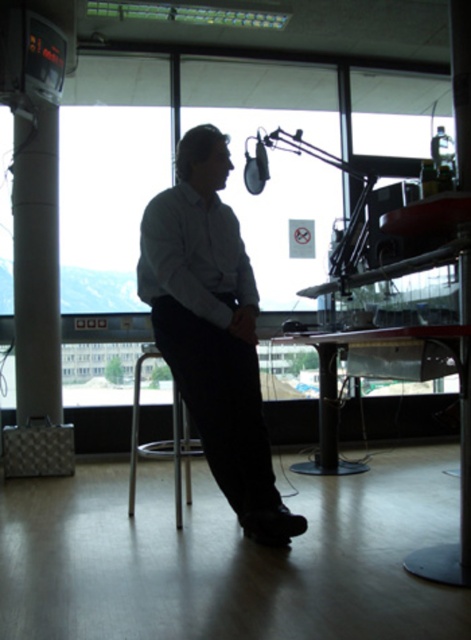
You are a photographer adjusting the lighting in the studio. You need to ensure that both the white glossy pillar at left and the white matte dress shirt at center are properly lit. Since the pillar is reflective, it might cause glare. Given their positions, which object is closer to the left side of the frame and could potentially reflect light back into the camera?

The white glossy pillar at left is to the left of the white matte dress shirt at center, so it is closer to the left side of the frame. This position makes it more likely to reflect light back into the camera, causing glare.

You are a photographer adjusting the camera settings. The camera is currently focused on the point at coordinates point (x=55, y=371). If the camera requires a focus distance of at least 4 meters to capture the subject clearly, will the current focus distance work?

The point (x=55, y=371) is 4.09 meters away from the camera, which meets the minimum focus distance requirement of 4 meters. Therefore, the current focus distance will work.